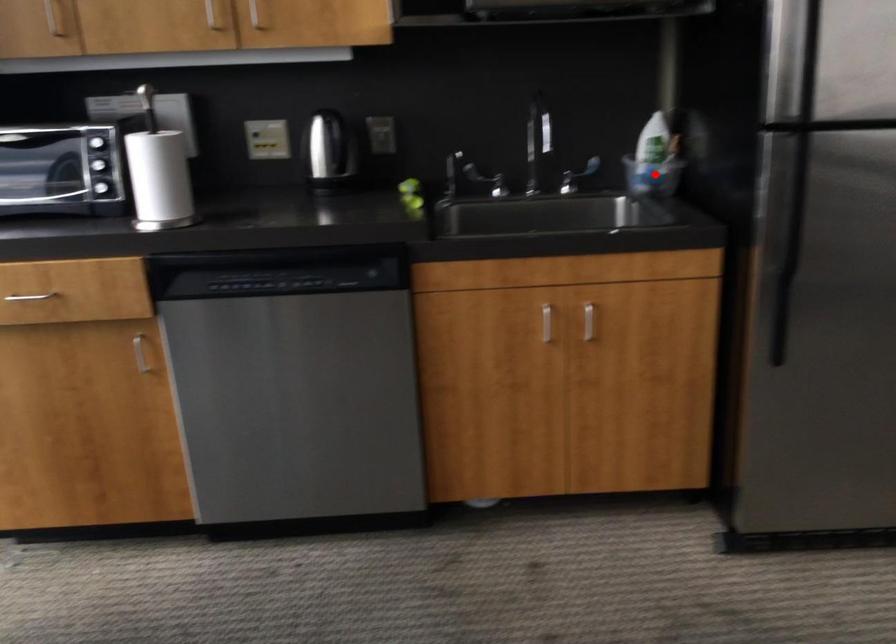
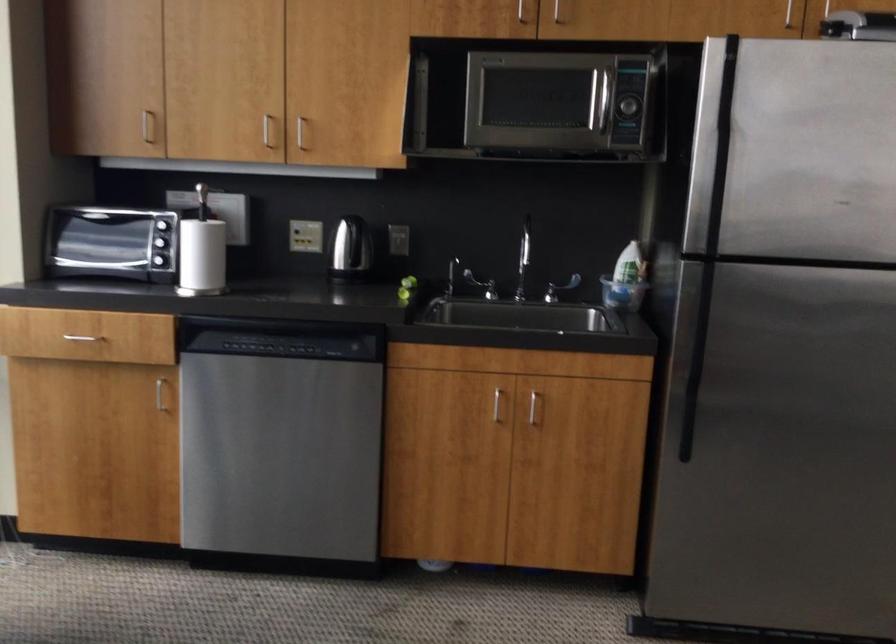
Question: I am providing you with two images of the same scene from different viewpoints. A red point is shown in image1. For the corresponding object point in image2, is it positioned nearer or farther from the camera?

Choices:
 (A) Nearer
 (B) Farther

Answer: (B)